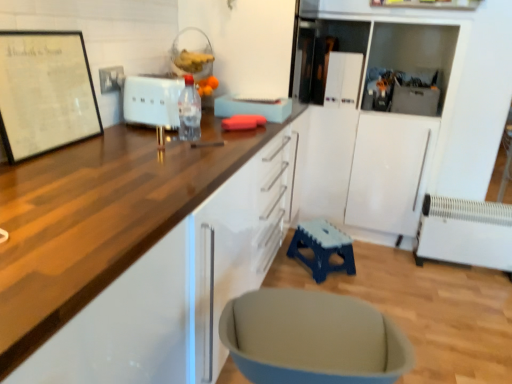
What are the coordinates of `vacant area situated to the left side of white plastic radiator at lower right` in the screenshot? It's located at (404, 272).